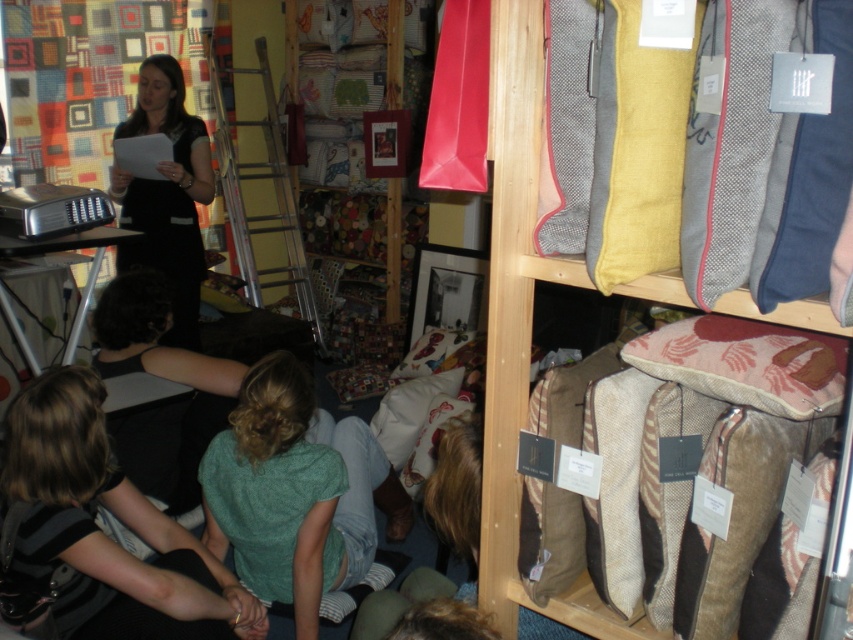
Is black dress at upper left shorter than pink fabric pillow at lower right?

In fact, black dress at upper left may be taller than pink fabric pillow at lower right.

Is point (166, 84) closer to viewer compared to point (817, 387)?

No.

Where is `black dress at upper left`? This screenshot has width=853, height=640. black dress at upper left is located at coordinates (166, 195).

Who is positioned more to the left, blonde hair at lower left or textured woolen cushion at upper right?

blonde hair at lower left is more to the left.

Is blonde hair at lower left smaller than textured woolen cushion at upper right?

No.

Which is in front, point (164, 564) or point (540, 81)?

Point (540, 81)

The image size is (853, 640). I want to click on blonde hair at lower left, so click(102, 531).

Can you confirm if blonde hair at lower left is positioned to the left of pink fabric pillow at lower right?

Indeed, blonde hair at lower left is positioned on the left side of pink fabric pillow at lower right.

Between blonde hair at lower left and pink fabric pillow at lower right, which one is positioned lower?

blonde hair at lower left

Between point (143, 592) and point (805, 376), which one is positioned behind?

The point (143, 592) is more distant.

At what (x,y) coordinates should I click in order to perform the action: click on blonde hair at lower left. Please return your answer as a coordinate pair (x, y). The height and width of the screenshot is (640, 853). Looking at the image, I should click on (102, 531).